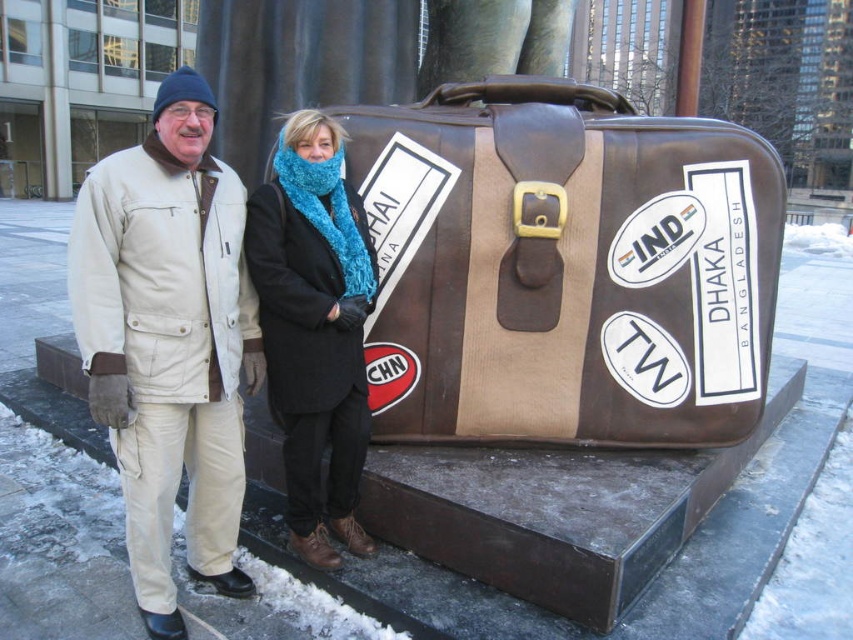
Between point (527, 420) and point (231, 512), which one is positioned behind?

Point (527, 420)

Does point (714, 157) come in front of point (91, 310)?

No, (714, 157) is behind (91, 310).

Image resolution: width=853 pixels, height=640 pixels. I want to click on brown leather suitcase at center, so click(564, 268).

In the scene shown: Which is more to the left, beige cotton jacket at left or knitted blue scarf at center?

From the viewer's perspective, beige cotton jacket at left appears more on the left side.

Who is higher up, beige cotton jacket at left or knitted blue scarf at center?

knitted blue scarf at center is higher up.

Locate an element on the screen. This screenshot has width=853, height=640. beige cotton jacket at left is located at coordinates (167, 340).

Does brown leather suitcase at center have a lesser height compared to knitted blue scarf at center?

Yes, brown leather suitcase at center is shorter than knitted blue scarf at center.

Between brown leather suitcase at center and knitted blue scarf at center, which one has more height?

knitted blue scarf at center

This screenshot has width=853, height=640. Identify the location of brown leather suitcase at center. (564, 268).